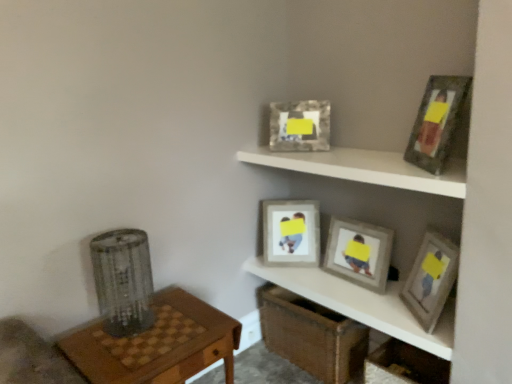
The width and height of the screenshot is (512, 384). I want to click on free region under white matte shelf at upper center, placed as the 1th shelf when sorted from top to bottom (from a real-world perspective), so click(334, 287).